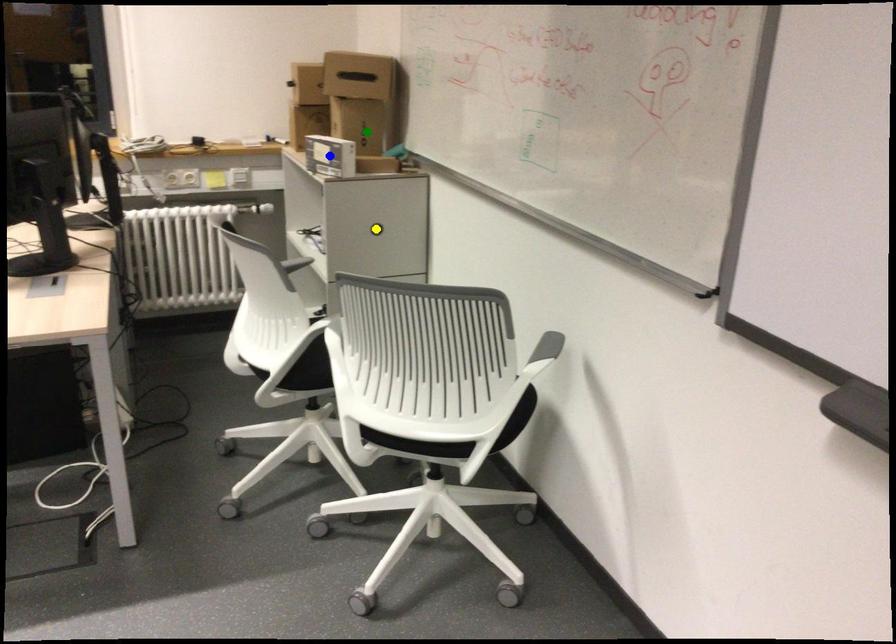
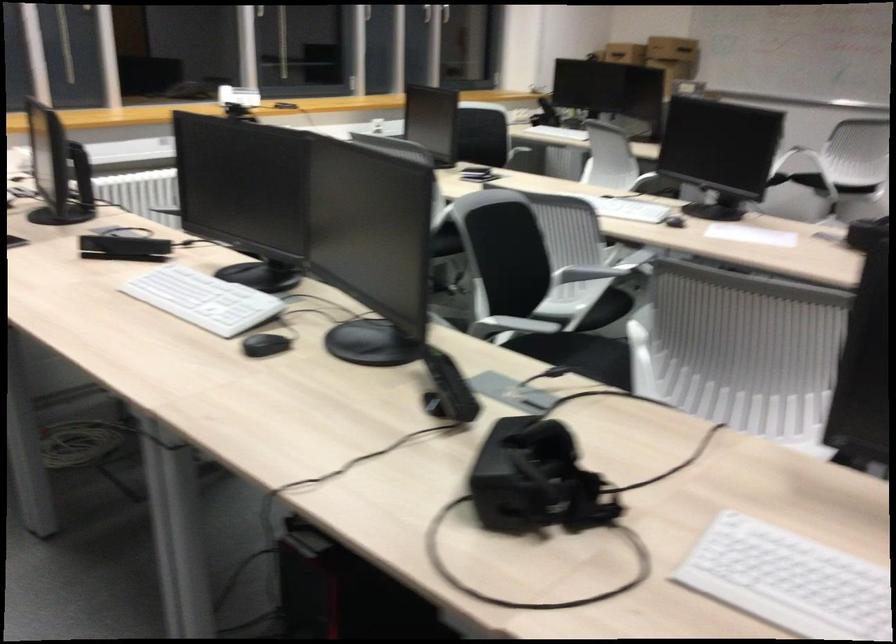
I am providing you with two images of the same scene from different viewpoints. Three points are marked in image1. Which point corresponds to a part or object that is occluded in image2?In image1, three points are marked. Which of them correspond to a part or object that is occluded in image2?Among the three points shown in image1, which one corresponds to a part or object that is no longer visible due to occlusion in image2?

green point, blue point, yellow point